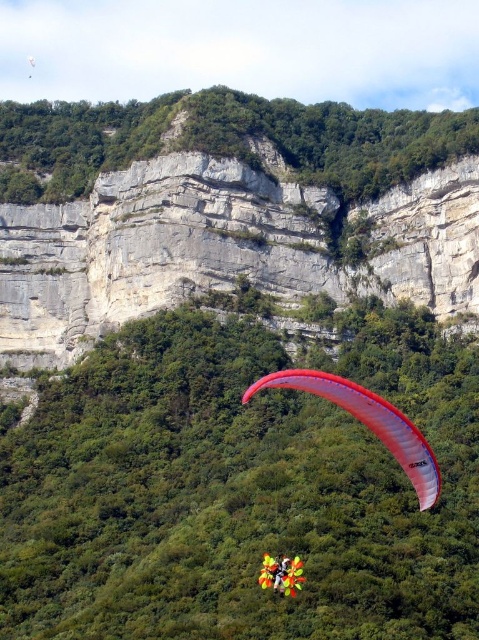
Question: Is rugged stone cliff at upper center positioned behind yellow fabric parachute at center?

Choices:
 (A) yes
 (B) no

Answer: (A)

Question: Which point is closer to the camera taking this photo?

Choices:
 (A) (278, 381)
 (B) (30, 160)
 (C) (282, 582)

Answer: (C)

Question: Which is farther from the rugged stone cliff at upper center?

Choices:
 (A) yellow fabric parachute at center
 (B) translucent red paraglider at center

Answer: (A)

Question: Can you confirm if translucent red paraglider at center is positioned to the left of yellow fabric parachute at center?

Choices:
 (A) no
 (B) yes

Answer: (A)

Question: Which point is closer to the camera taking this photo?

Choices:
 (A) (278, 579)
 (B) (275, 134)
 (C) (360, 385)

Answer: (A)

Question: Does rugged stone cliff at upper center appear on the left side of translucent red paraglider at center?

Choices:
 (A) no
 (B) yes

Answer: (B)